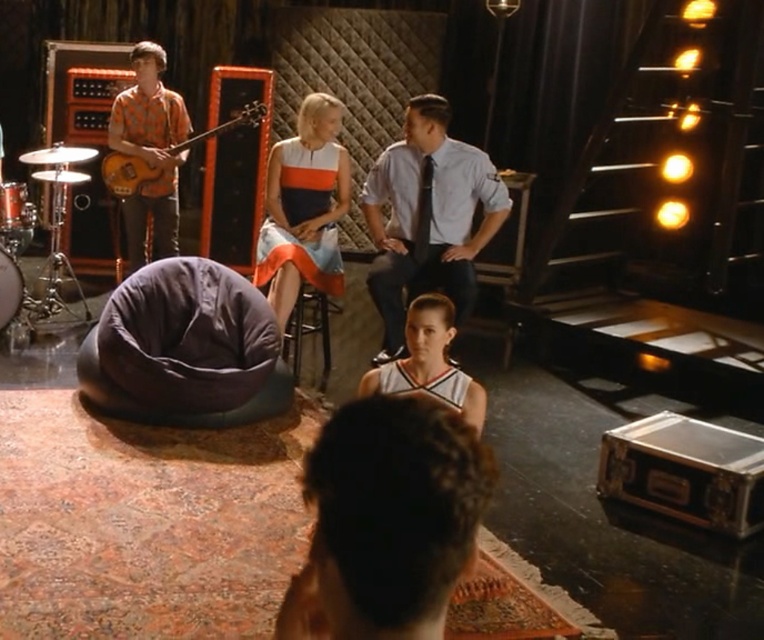
You are a photographer setting up a shoot in the music studio. You need to place a white jersey at center in front of the dark gray fabric bean bag chair at lower center. Can the bean bag chair accommodate the jersey comfortably?

The dark gray fabric bean bag chair at lower center is larger in size than the white jersey at center, so yes, the bean bag chair can accommodate the jersey comfortably.

Consider the image. You are a visitor in the music studio and want to sit down. You see the dark gray fabric bean bag chair at lower center and the brushed metal drum at lower left. Which one is bigger and can accommodate you comfortably?

The dark gray fabric bean bag chair at lower center is larger in size than the brushed metal drum at lower left, so it can accommodate you comfortably.

Based on the scene description, can you determine which object is positioned higher relative to the other between the orange patterned shirt at left and the brushed metal drum at lower left?

The orange patterned shirt at left is located above the brushed metal drum at lower left, so it is positioned higher.